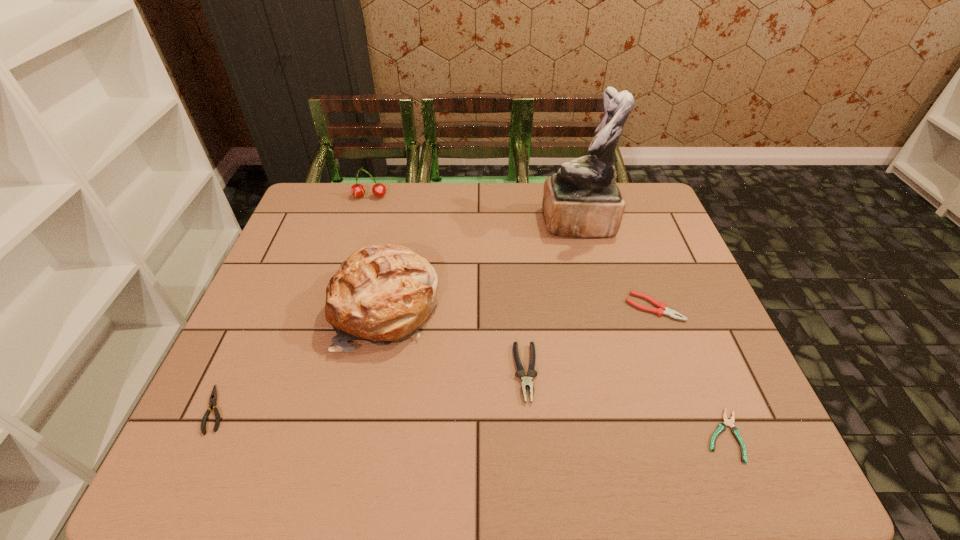
In order to click on blank region between the leftmost object and the fifth shortest object in this screenshot , I will do `click(293, 303)`.

Where is `vacant space that is in between the fourth shortest object and the tallest object`? vacant space that is in between the fourth shortest object and the tallest object is located at coordinates (552, 298).

Locate an element on the screen. The width and height of the screenshot is (960, 540). object that is the sixth nearest to the second pliers from left to right is located at coordinates (357, 190).

Select which object appears as the second closest to the third tallest object. Please provide its 2D coordinates. Your answer should be formatted as a tuple, i.e. [(x, y)], where the tuple contains the x and y coordinates of a point satisfying the conditions above.

[(582, 200)]

Identify which pliers is located as the second nearest to the leftmost pliers. Please provide its 2D coordinates. Your answer should be formatted as a tuple, i.e. [(x, y)], where the tuple contains the x and y coordinates of a point satisfying the conditions above.

[(659, 311)]

Choose which pliers is the nearest neighbor to the leftmost pliers. Please provide its 2D coordinates. Your answer should be formatted as a tuple, i.e. [(x, y)], where the tuple contains the x and y coordinates of a point satisfying the conditions above.

[(526, 382)]

The width and height of the screenshot is (960, 540). I want to click on vacant point that satisfies the following two spatial constraints: 1. in a relaxed pose on the tallest object; 2. on the right side of the shortest pliers, so click(x=632, y=435).

The height and width of the screenshot is (540, 960). In order to click on free spot that satisfies the following two spatial constraints: 1. in a relaxed pose on the sculpture; 2. on the left side of the farthest pliers in this screenshot , I will do coord(599,307).

The image size is (960, 540). What are the coordinates of `free point that satisfies the following two spatial constraints: 1. with stems pointing upwards on the third shortest object; 2. on the right side of the third tallest object` in the screenshot? It's located at (336, 307).